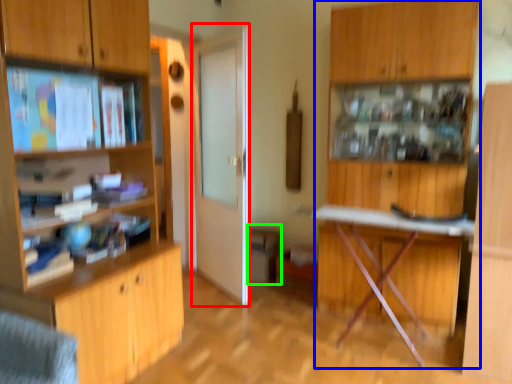
Question: Which object is the farthest from door (highlighted by a red box)? Choose among these: dresser (highlighted by a blue box) or cabinetry (highlighted by a green box).

Choices:
 (A) dresser
 (B) cabinetry

Answer: (A)